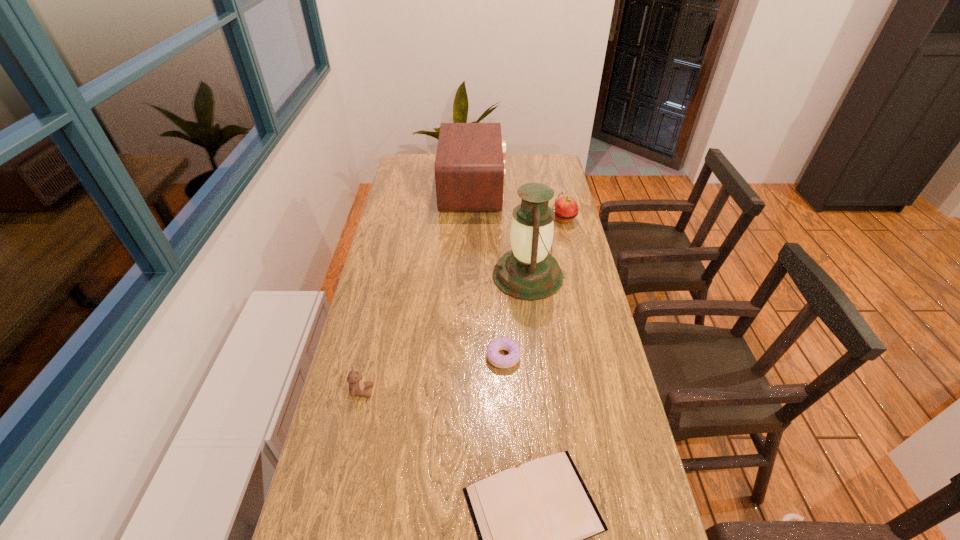
Find the location of `free point at the right edge`. free point at the right edge is located at coordinates (606, 490).

At what (x,y) coordinates should I click in order to perform the action: click on free space at the far left corner. Please return your answer as a coordinate pair (x, y). This screenshot has height=540, width=960. Looking at the image, I should click on (433, 153).

Find the location of a particular element. Image resolution: width=960 pixels, height=540 pixels. free spot between the teddy bear and the radio receiver is located at coordinates (418, 290).

At what (x,y) coordinates should I click in order to perform the action: click on unoccupied area between the leftmost object and the fourth nearest object. Please return your answer as a coordinate pair (x, y). Looking at the image, I should click on (445, 334).

You are a GUI agent. You are given a task and a screenshot of the screen. Output one action in this format:
    pyautogui.click(x=<x>, y=<y>)
    Task: Click on the free spot between the second tallest object and the third farthest object
    The width and height of the screenshot is (960, 540).
    Given the screenshot: What is the action you would take?
    pyautogui.click(x=500, y=232)

Where is `vacant space that's between the radio receiver and the fifth tallest object`? This screenshot has height=540, width=960. vacant space that's between the radio receiver and the fifth tallest object is located at coordinates (489, 273).

I want to click on empty space between the teddy bear and the fourth shortest object, so click(x=463, y=305).

This screenshot has height=540, width=960. What are the coordinates of `vacant region between the second nearest object and the lantern` in the screenshot? It's located at (445, 334).

Locate an element on the screen. object that stands as the fourth closest to the apple is located at coordinates (532, 522).

Identify which object is the closest to the shortest object. Please provide its 2D coordinates. Your answer should be formatted as a tuple, i.e. [(x, y)], where the tuple contains the x and y coordinates of a point satisfying the conditions above.

[(503, 343)]